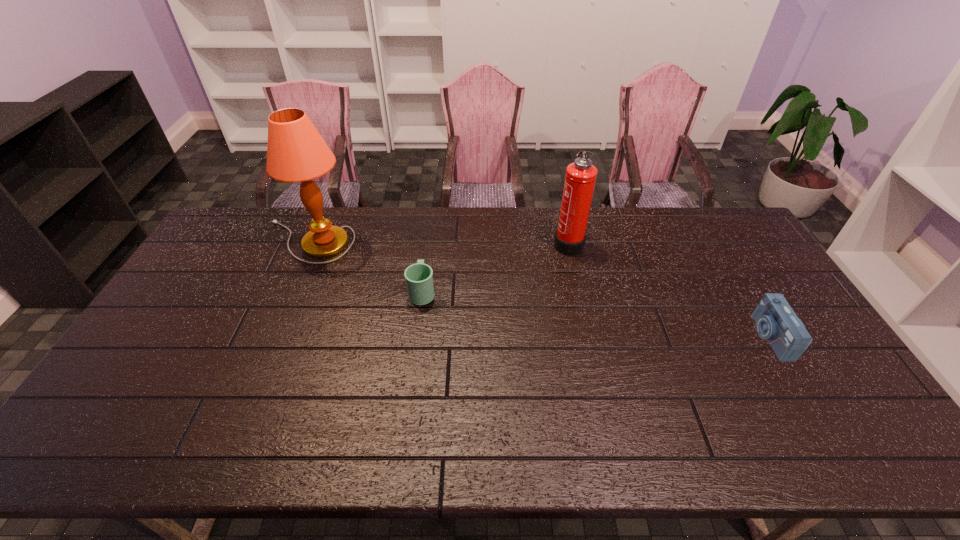
Where is `vacant space located on the front-facing side of the fire extinguisher`? The image size is (960, 540). vacant space located on the front-facing side of the fire extinguisher is located at coordinates (476, 242).

Image resolution: width=960 pixels, height=540 pixels. Find the location of `free space located 0.300m on the front-facing side of the fire extinguisher`. free space located 0.300m on the front-facing side of the fire extinguisher is located at coordinates (468, 242).

This screenshot has width=960, height=540. Identify the location of free spot located 0.310m on the side of the third object from right to left with the handle. (432, 220).

In order to click on vacant space located on the side of the third object from right to left with the handle in this screenshot , I will do `click(433, 206)`.

Locate an element on the screen. The height and width of the screenshot is (540, 960). free spot located on the side of the third object from right to left with the handle is located at coordinates (428, 248).

You are a GUI agent. You are given a task and a screenshot of the screen. Output one action in this format:
    pyautogui.click(x=<x>, y=<y>)
    Task: Click on the vacant space located 0.340m on the lens of the camera
    This screenshot has height=540, width=960.
    Given the screenshot: What is the action you would take?
    pyautogui.click(x=637, y=336)

The width and height of the screenshot is (960, 540). I want to click on free space located on the lens of the camera, so click(x=687, y=336).

Identify the location of vacant region located on the lens of the camera. (637, 336).

Identify the location of lamp located in the far edge section of the desktop. The height and width of the screenshot is (540, 960). (296, 152).

Find the location of a particular element. fire extinguisher that is at the far edge is located at coordinates (580, 179).